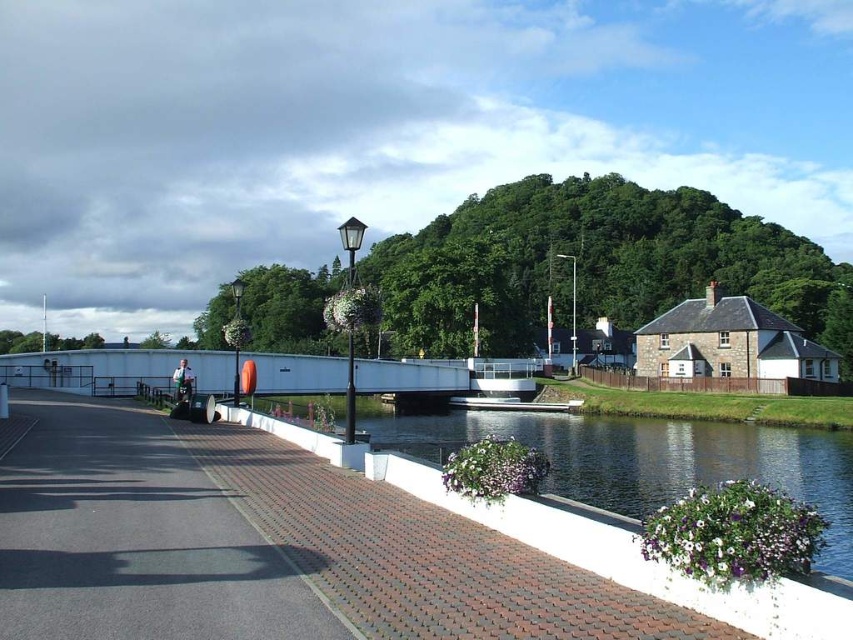
Measure the distance between point (125, 410) and camera.

A distance of 90.79 feet exists between point (125, 410) and camera.

Who is taller, dark gray asphalt at lower left or white metallic bridge at center?

white metallic bridge at center

Does point (231, 577) lie behind point (103, 355)?

No, (231, 577) is closer to viewer.

The width and height of the screenshot is (853, 640). In order to click on dark gray asphalt at lower left in this screenshot , I will do `click(134, 538)`.

Which is below, dark gray asphalt at lower left or white concrete wall at lower center?

white concrete wall at lower center is lower down.

Which of these two, dark gray asphalt at lower left or white concrete wall at lower center, stands taller?

white concrete wall at lower center is taller.

Is point (229, 556) farther from camera compared to point (660, 464)?

No, (229, 556) is closer to viewer.

Identify the location of dark gray asphalt at lower left. The image size is (853, 640). (134, 538).

Does point (363, 428) lie in front of point (141, 376)?

No, it is not.

Based on the photo, does white concrete wall at lower center have a larger size compared to white metallic bridge at center?

Yes, white concrete wall at lower center is bigger than white metallic bridge at center.

Who is more distant from viewer, (625,452) or (97,364)?

Positioned behind is point (97,364).

I want to click on white concrete wall at lower center, so click(x=646, y=458).